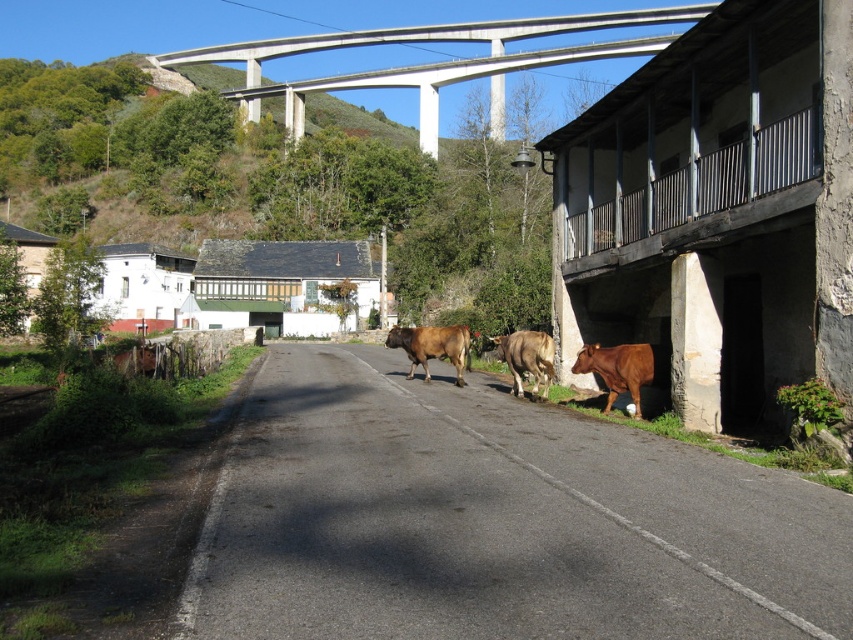
Based on the photo, you are a delivery driver approaching the rural scene. You need to park your truck on the concrete at upper center. Considering the size of the brown matte bull at center, will there be enough space for your truck to park without disturbing the bull?

The concrete at upper center is bigger than the brown matte bull at center, so there should be sufficient space to park the truck without disturbing the bull.